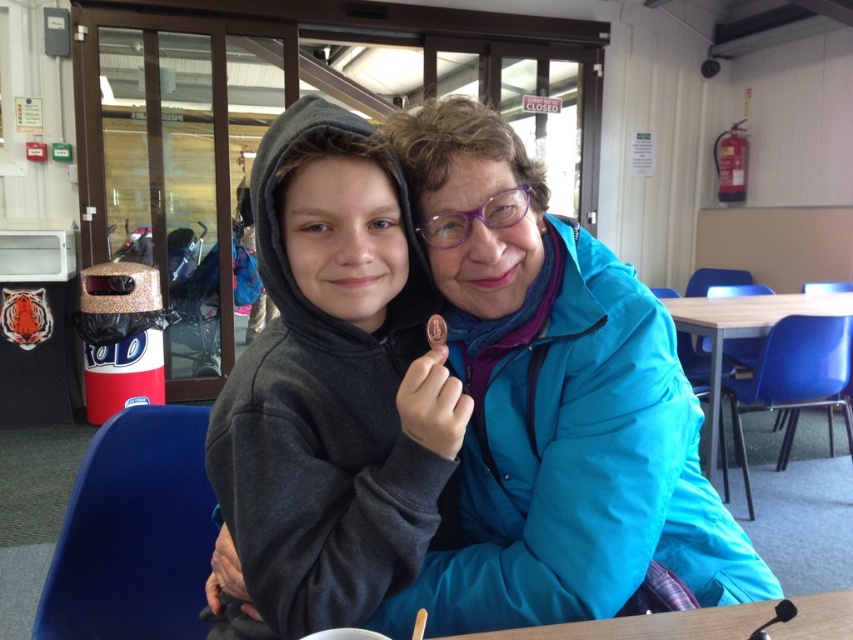
Question: Does matte gray hoodie at center have a smaller size compared to wooden table at center?

Choices:
 (A) yes
 (B) no

Answer: (A)

Question: Which object appears farthest from the camera in this image?

Choices:
 (A) wooden table at lower center
 (B) wooden table at center

Answer: (B)

Question: Is blue fuzzy jacket at center thinner than matte gray hoodie at center?

Choices:
 (A) no
 (B) yes

Answer: (A)

Question: Which of the following is the closest to the observer?

Choices:
 (A) wooden table at lower center
 (B) wooden table at center
 (C) blue fuzzy jacket at center

Answer: (A)

Question: Estimate the real-world distances between objects in this image. Which object is farther from the wooden table at lower center?

Choices:
 (A) matte gray hoodie at center
 (B) blue fuzzy jacket at center

Answer: (A)

Question: From the image, what is the correct spatial relationship of matte gray hoodie at center in relation to wooden table at center?

Choices:
 (A) below
 (B) above

Answer: (B)